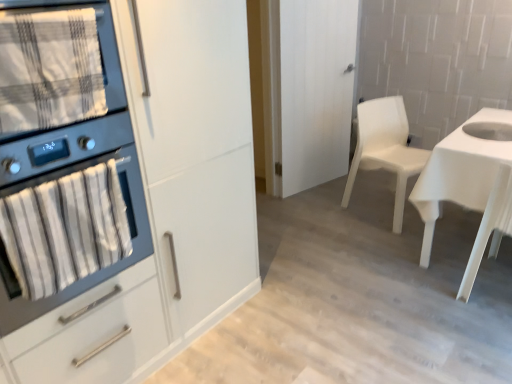
You are a GUI agent. You are given a task and a screenshot of the screen. Output one action in this format:
    pyautogui.click(x=<x>, y=<y>)
    Task: Click on the vacant space underneath white plastic chair at center-right (from a real-world perspective)
    
    Given the screenshot: What is the action you would take?
    pyautogui.click(x=375, y=207)